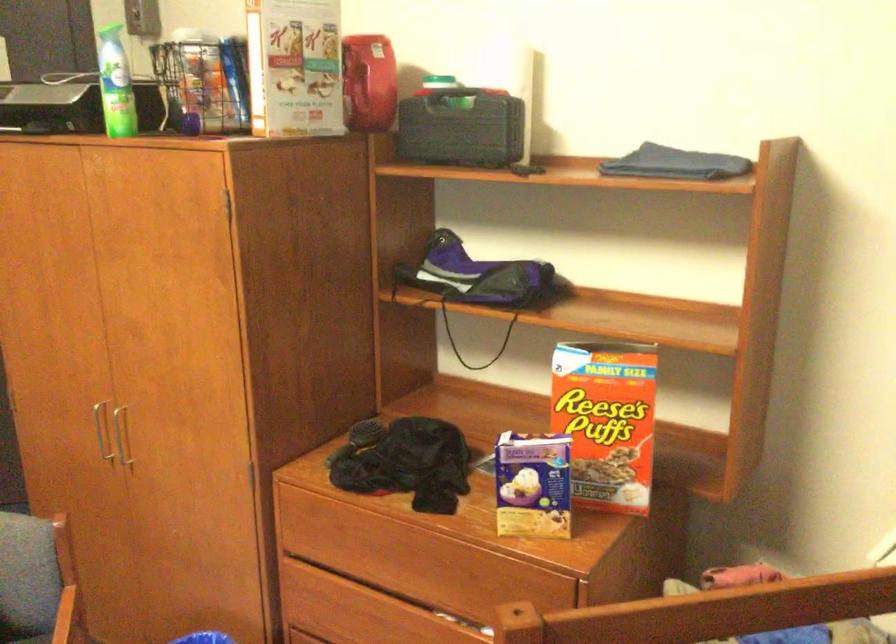
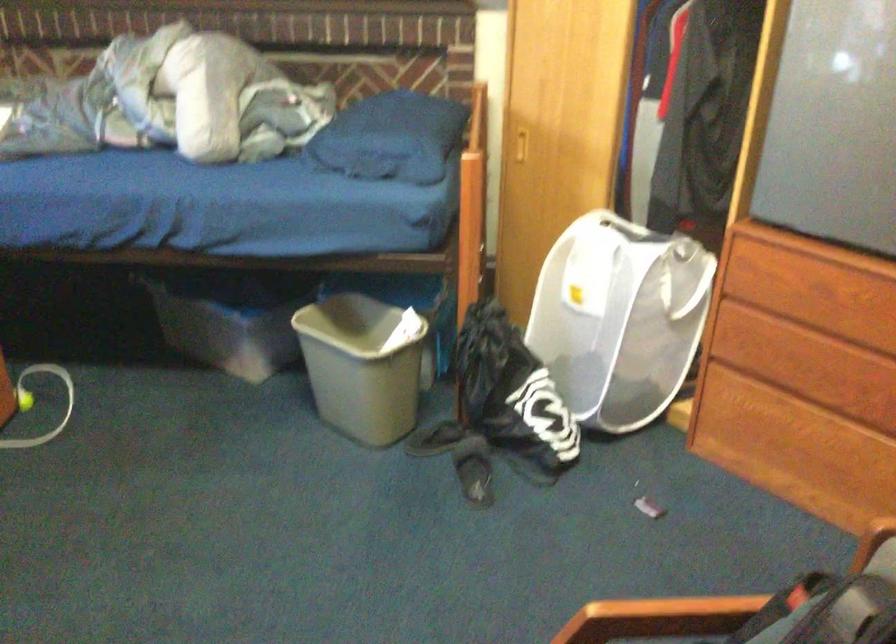
The images are taken continuously from a first-person perspective. In which direction is your viewpoint rotating?

The camera's rotation is toward left-down.